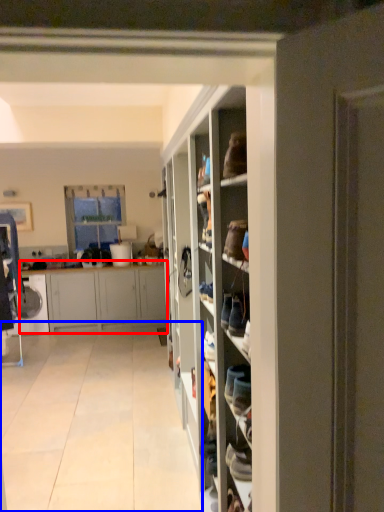
Question: Which of the following is the closest to the observer, cabinetry (highlighted by a red box) or corridor (highlighted by a blue box)?

Choices:
 (A) cabinetry
 (B) corridor

Answer: (B)